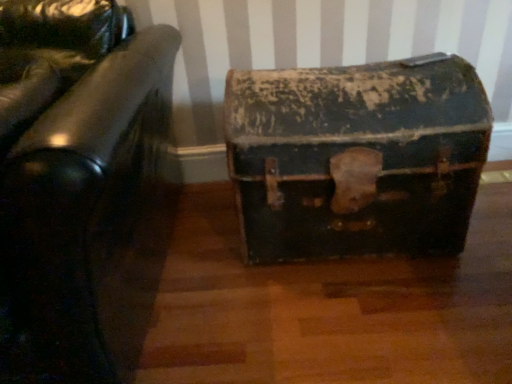
Identify the location of rusty metal trunk at center. The height and width of the screenshot is (384, 512). (77, 183).

Describe the element at coordinates (77, 183) in the screenshot. The image size is (512, 384). I see `rusty metal trunk at center` at that location.

What do you see at coordinates (356, 157) in the screenshot? I see `rusty metal trunk at center` at bounding box center [356, 157].

The height and width of the screenshot is (384, 512). What are the coordinates of `rusty metal trunk at center` in the screenshot? It's located at (356, 157).

You are a GUI agent. You are given a task and a screenshot of the screen. Output one action in this format:
    pyautogui.click(x=<x>, y=<y>)
    Task: Click on the rusty metal trunk at center
    This screenshot has width=512, height=384.
    Given the screenshot: What is the action you would take?
    pyautogui.click(x=77, y=183)

Does rusty metal trunk at center appear on the left side of rusty metal trunk at center?

Yes.

Between rusty metal trunk at center and rusty metal trunk at center, which one is positioned behind?

Positioned behind is rusty metal trunk at center.

Is point (113, 148) farther from viewer compared to point (277, 206)?

No, it is in front of (277, 206).

From the image's perspective, relative to rusty metal trunk at center, is rusty metal trunk at center above or below?

From the image's perspective, rusty metal trunk at center appears below rusty metal trunk at center.

From a real-world perspective, is rusty metal trunk at center beneath rusty metal trunk at center?

Incorrect, from a real-world perspective, rusty metal trunk at center is higher than rusty metal trunk at center.

Does rusty metal trunk at center have a lesser width compared to rusty metal trunk at center?

No, rusty metal trunk at center is not thinner than rusty metal trunk at center.

In terms of height, does rusty metal trunk at center look taller or shorter compared to rusty metal trunk at center?

Clearly, rusty metal trunk at center is taller compared to rusty metal trunk at center.

Is rusty metal trunk at center bigger or smaller than rusty metal trunk at center?

rusty metal trunk at center is bigger than rusty metal trunk at center.

Is rusty metal trunk at center located within rusty metal trunk at center?

Definitely not — rusty metal trunk at center is not inside rusty metal trunk at center.

Is rusty metal trunk at center far from rusty metal trunk at center?

They are positioned close to each other.

Is rusty metal trunk at center at the back of rusty metal trunk at center?

rusty metal trunk at center is not turned away from rusty metal trunk at center.

How distant is rusty metal trunk at center from rusty metal trunk at center?

rusty metal trunk at center is 21.60 inches from rusty metal trunk at center.

This screenshot has width=512, height=384. Find the location of `furniture in front of the rusty metal trunk at center`. furniture in front of the rusty metal trunk at center is located at coordinates (77, 183).

Considering the relative positions of rusty metal trunk at center and rusty metal trunk at center in the image provided, is rusty metal trunk at center to the left of rusty metal trunk at center from the viewer's perspective?

In fact, rusty metal trunk at center is to the right of rusty metal trunk at center.

Who is more distant, rusty metal trunk at center or rusty metal trunk at center?

rusty metal trunk at center is further away from the camera.

Is point (338, 163) behind point (126, 71)?

Yes, point (338, 163) is behind point (126, 71).

From the image's perspective, would you say rusty metal trunk at center is shown under rusty metal trunk at center?

No.

From a real-world perspective, is rusty metal trunk at center physically above rusty metal trunk at center?

Incorrect, from a real-world perspective, rusty metal trunk at center is lower than rusty metal trunk at center.

Between rusty metal trunk at center and rusty metal trunk at center, which one has larger width?

rusty metal trunk at center.

Who is taller, rusty metal trunk at center or rusty metal trunk at center?

rusty metal trunk at center.

Can you confirm if rusty metal trunk at center is bigger than rusty metal trunk at center?

No.

Do you think rusty metal trunk at center is within rusty metal trunk at center, or outside of it?

rusty metal trunk at center is not inside rusty metal trunk at center, it's outside.

Is rusty metal trunk at center not near rusty metal trunk at center?

No, there isn't a large distance between rusty metal trunk at center and rusty metal trunk at center.

Is rusty metal trunk at center aimed at rusty metal trunk at center?

No, rusty metal trunk at center is not turned towards rusty metal trunk at center.

At what (x,y) coordinates should I click in order to perform the action: click on suitcase behind the rusty metal trunk at center. Please return your answer as a coordinate pair (x, y). Looking at the image, I should click on (356, 157).

At what (x,y) coordinates should I click in order to perform the action: click on suitcase above the rusty metal trunk at center (from the image's perspective). Please return your answer as a coordinate pair (x, y). Looking at the image, I should click on (356, 157).

This screenshot has width=512, height=384. Find the location of `furniture on the left of the rusty metal trunk at center`. furniture on the left of the rusty metal trunk at center is located at coordinates (77, 183).